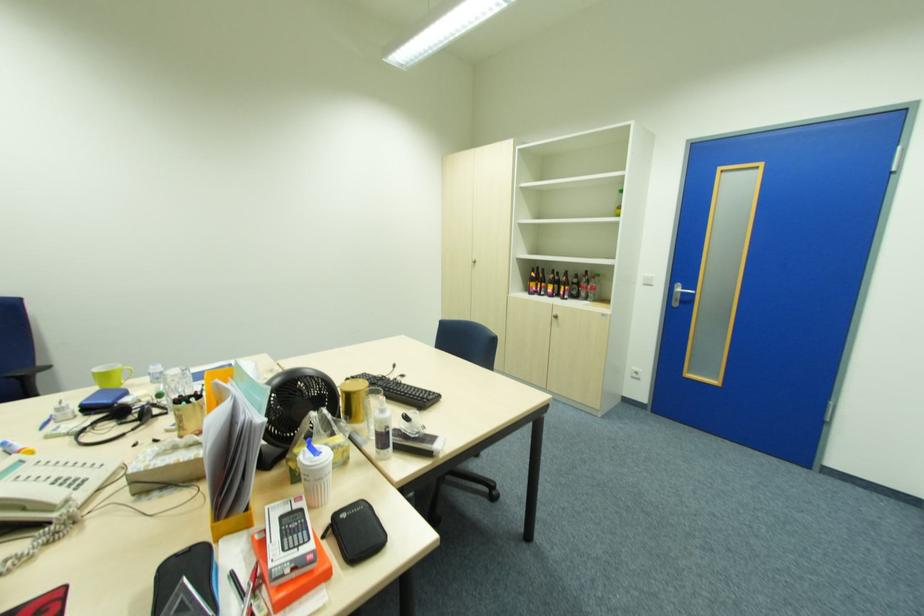
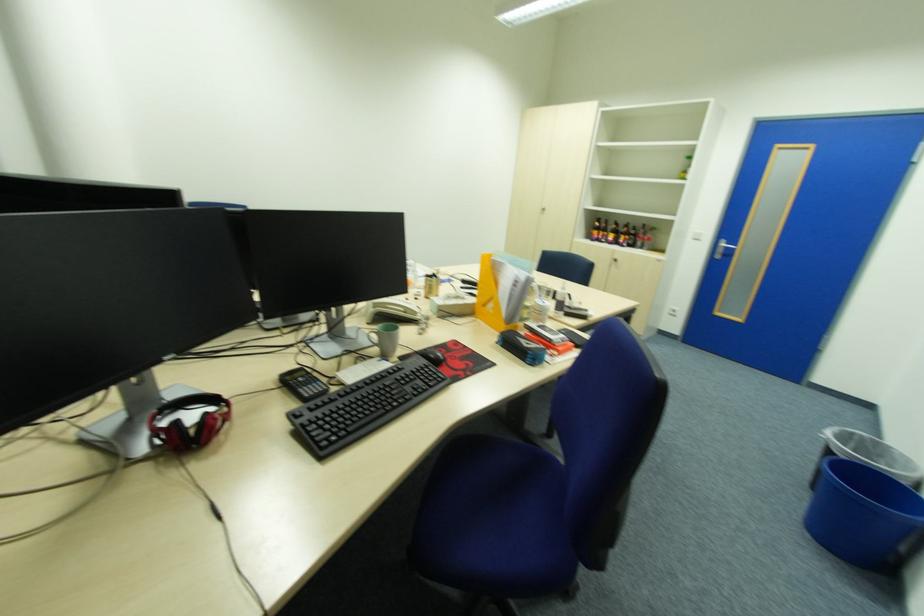
The images are taken continuously from a first-person perspective. In which direction are you moving?

The cameraman walked toward left, backward.